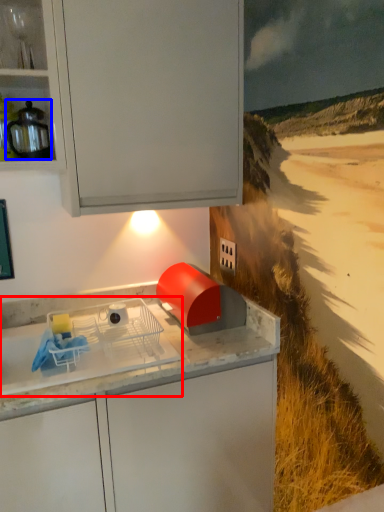
Question: Which of the following is the farthest to the observer, home appliance (highlighted by a red box) or kitchen appliance (highlighted by a blue box)?

Choices:
 (A) home appliance
 (B) kitchen appliance

Answer: (B)